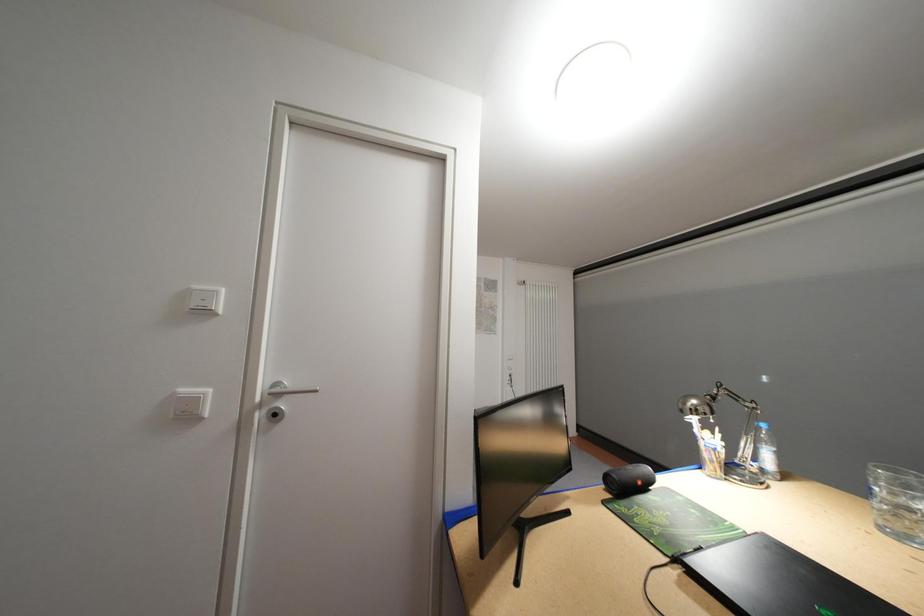
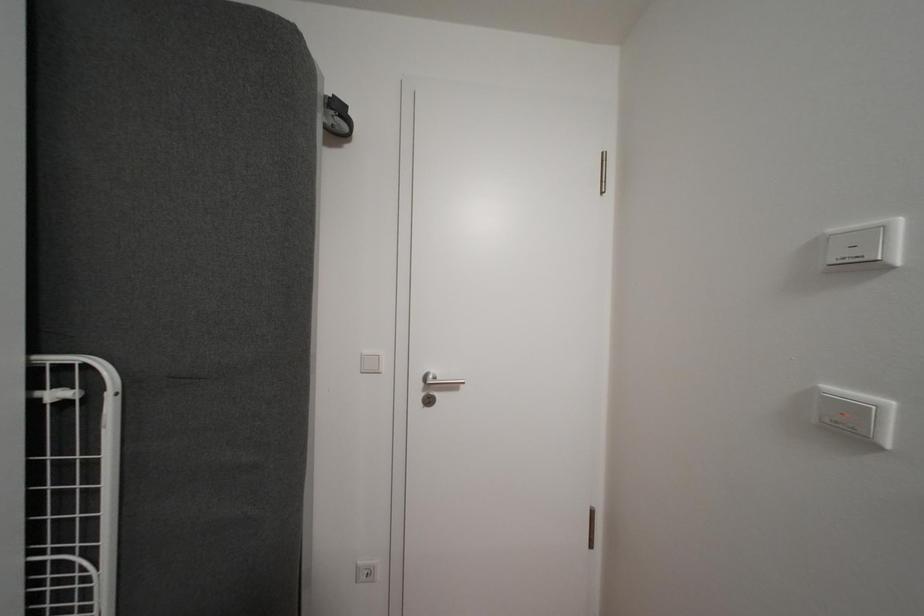
Question: The first image is from the beginning of the video and the second image is from the end. How did the camera likely rotate when shooting the video?

Choices:
 (A) Left
 (B) Right
 (C) Up
 (D) Down

Answer: (A)